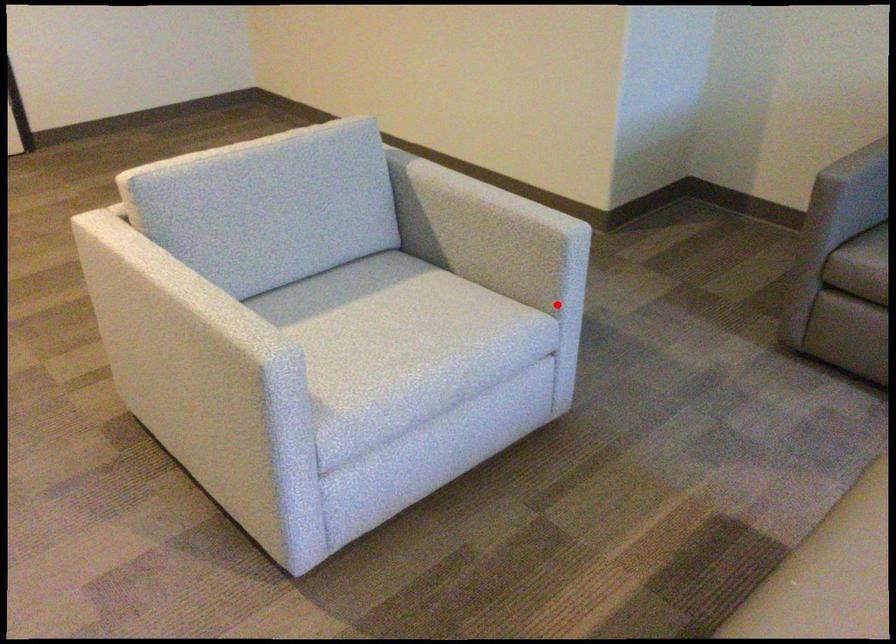
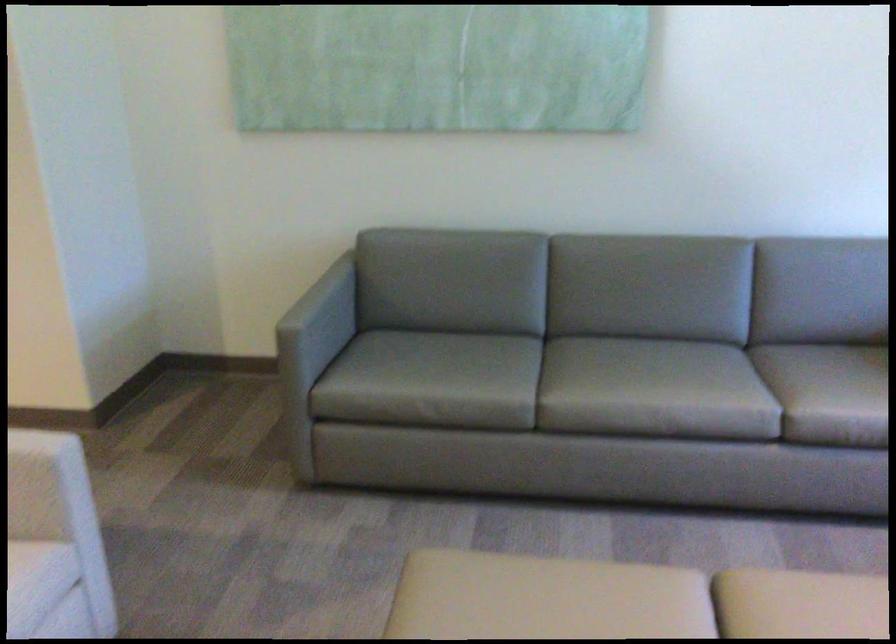
Question: I am providing you with two images of the same scene from different viewpoints. Image1 has a red point marked. In image2, the corresponding 3D location appears at what relative position? Reply with the corresponding letter.

Choices:
 (A) Closer
 (B) Farther

Answer: (A)